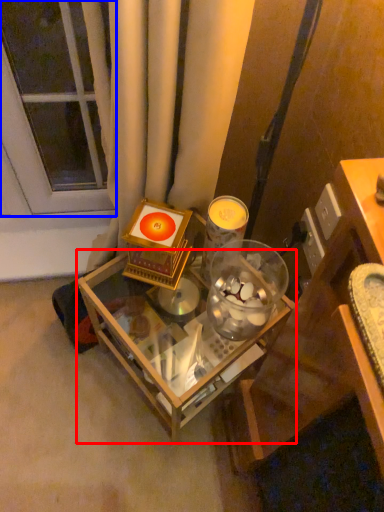
Question: Which object appears closest to the camera in this image, table (highlighted by a red box) or glass door (highlighted by a blue box)?

Choices:
 (A) table
 (B) glass door

Answer: (A)